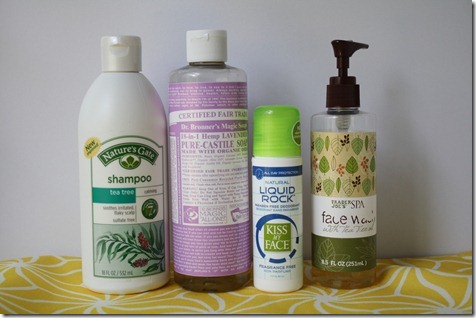
Identify the location of yellow and white patterned cloth. (417, 288), (48, 299).